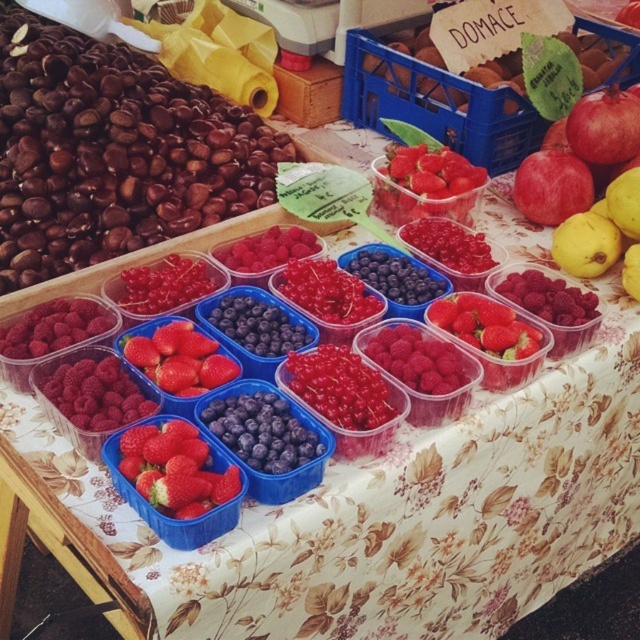
Question: Among these points, which one is farthest from the camera?

Choices:
 (A) (173, 344)
 (B) (557, 196)
 (C) (596, 252)
 (D) (609, 150)

Answer: (D)

Question: Does red matte apple at upper right have a greater width compared to yellow matte pear at right?

Choices:
 (A) yes
 (B) no

Answer: (A)

Question: Is red matte strawberries at center above glossy plastic container at center?

Choices:
 (A) yes
 (B) no

Answer: (B)

Question: Can you confirm if glossy plastic raspberry at center right is thinner than glossy plastic container at center?

Choices:
 (A) yes
 (B) no

Answer: (A)

Question: Which point is closer to the camera?

Choices:
 (A) glossy plastic container at center
 (B) red glossy pomegranate at upper right
 (C) yellow matte pear at right
 (D) red matte apple at upper right

Answer: (A)

Question: Which point is closer to the camera?

Choices:
 (A) red matte strawberries at center
 (B) yellow matte pear at right

Answer: (A)